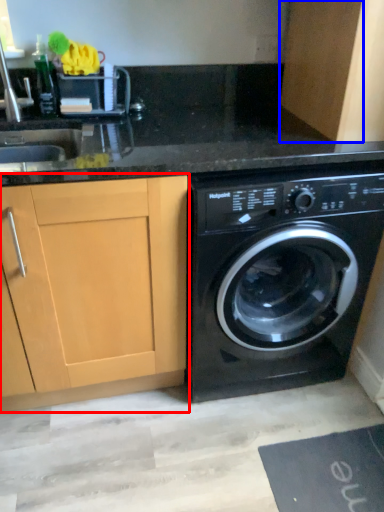
Question: Which object appears closest to the camera in this image, cabinetry (highlighted by a red box) or cabinetry (highlighted by a blue box)?

Choices:
 (A) cabinetry
 (B) cabinetry

Answer: (A)